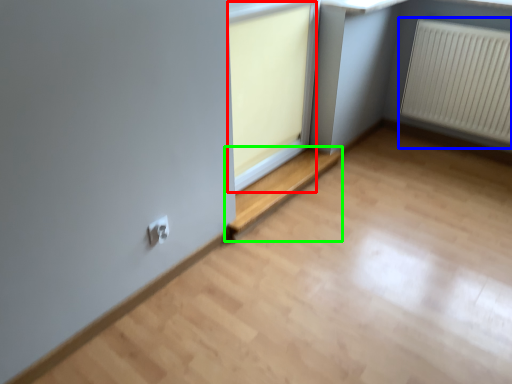
Question: Which object is the closest to the window frame (highlighted by a red box)? Choose among these: radiator (highlighted by a blue box) or window (highlighted by a green box).

Choices:
 (A) radiator
 (B) window

Answer: (B)